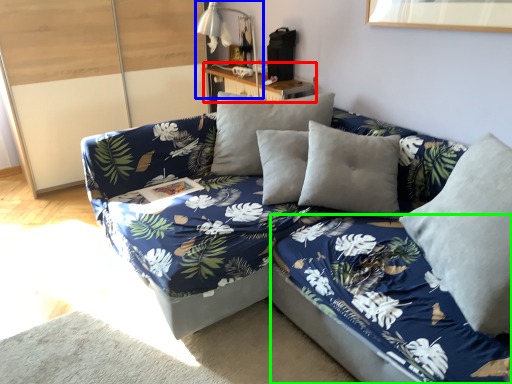
Question: Based on their relative distances, which object is farther from table (highlighted by a red box)? Choose from table lamp (highlighted by a blue box) and bed frame (highlighted by a green box).

Choices:
 (A) table lamp
 (B) bed frame

Answer: (B)